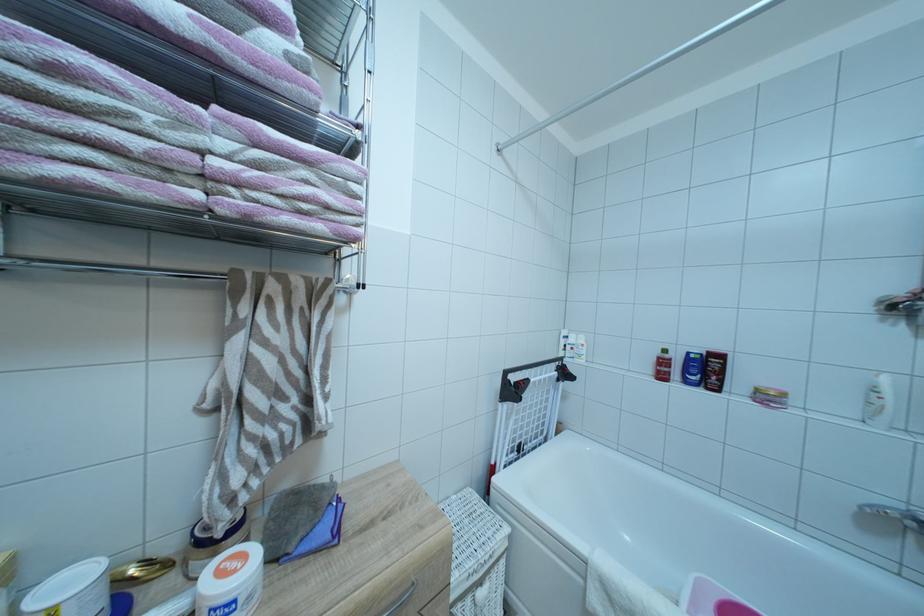
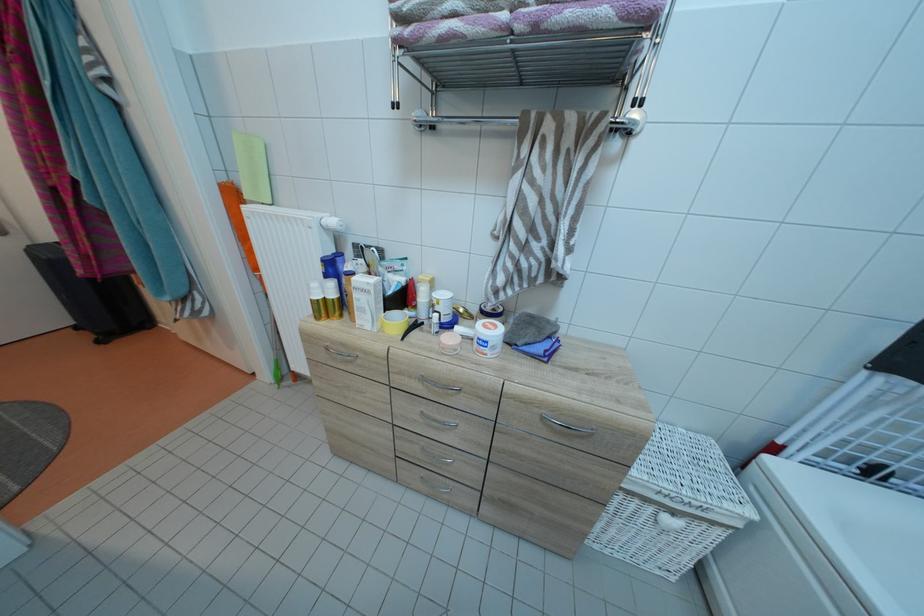
Find the pixel in the second image that matches point (241, 578) in the first image.

(496, 334)